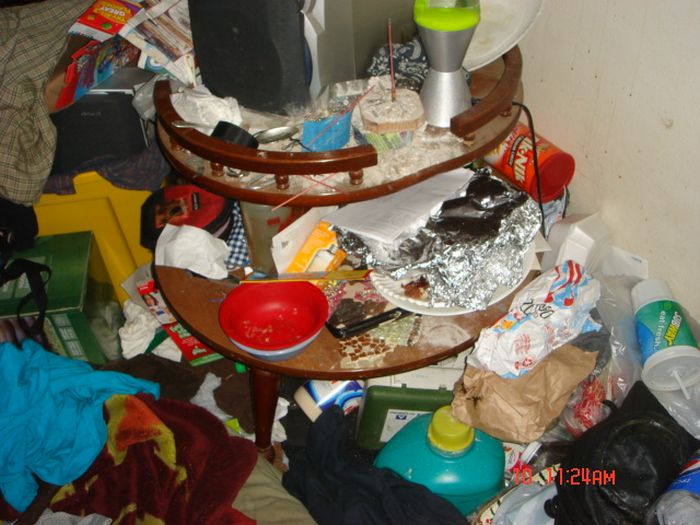
You are a GUI agent. You are given a task and a screenshot of the screen. Output one action in this format:
    pyautogui.click(x=<x>, y=<y>)
    Task: Click on the table
    
    Given the screenshot: What is the action you would take?
    pyautogui.click(x=200, y=299)